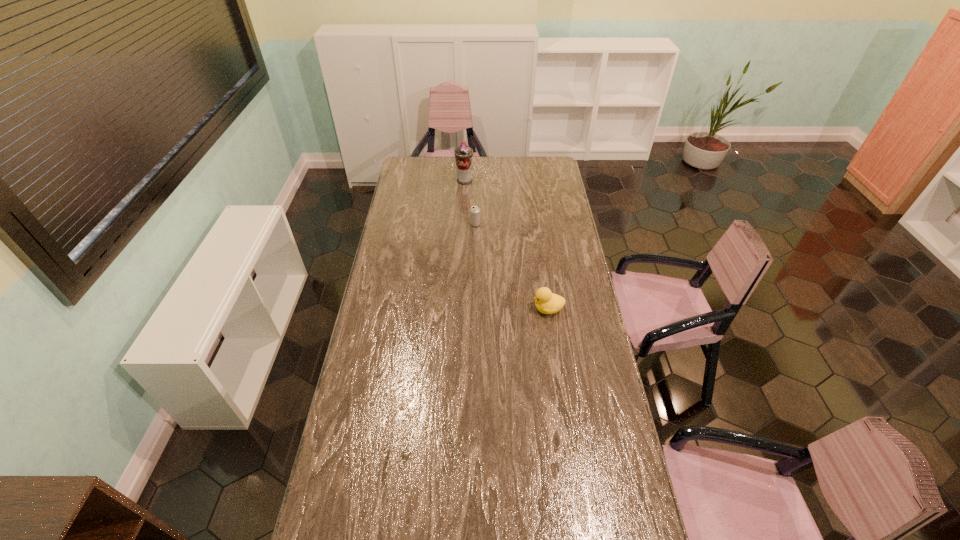
This screenshot has height=540, width=960. In order to click on blank region between the duck and the tallest object in this screenshot , I will do `click(506, 245)`.

Identify which object is the second closest to the aerosol can. Please provide its 2D coordinates. Your answer should be formatted as a tuple, i.e. [(x, y)], where the tuple contains the x and y coordinates of a point satisfying the conditions above.

[(546, 302)]

Where is `the second closest object to the nearest object`? the second closest object to the nearest object is located at coordinates (463, 154).